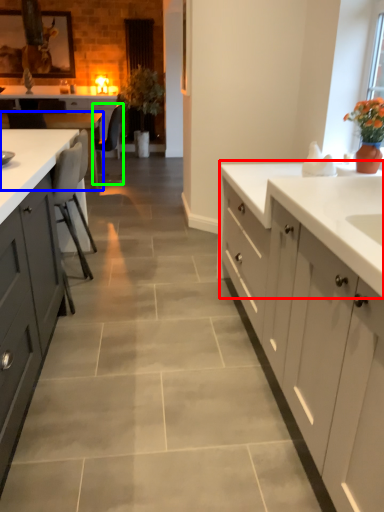
Question: Which object is positioned closest to countertop (highlighted by a red box)? Select from table (highlighted by a blue box) and chair (highlighted by a green box).

Choices:
 (A) table
 (B) chair

Answer: (A)